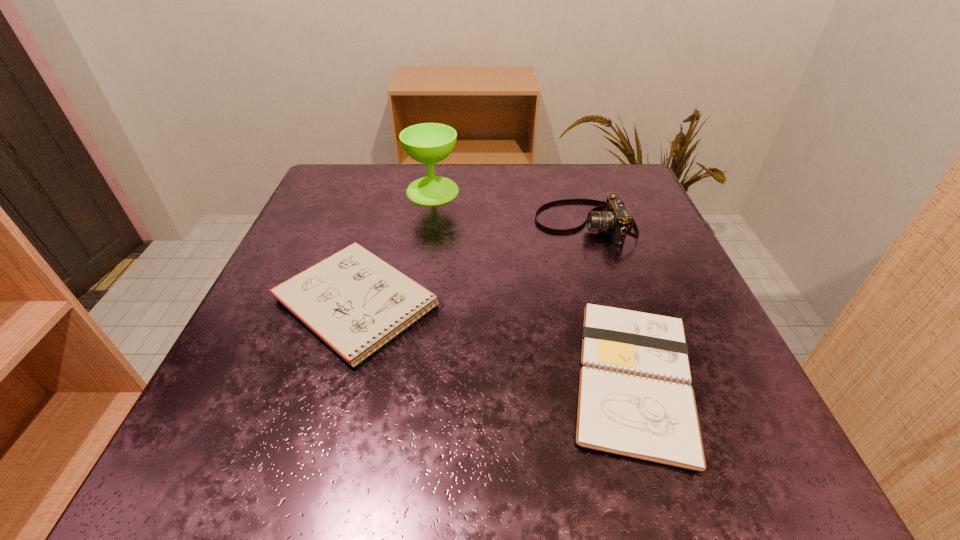
Locate an element on the screen. The width and height of the screenshot is (960, 540). vacant region located 0.120m on the right of the left notepad is located at coordinates (516, 303).

This screenshot has width=960, height=540. In order to click on vacant space situated 0.230m on the back of the shorter notepad in this screenshot , I will do `click(588, 228)`.

Image resolution: width=960 pixels, height=540 pixels. In order to click on wineglass situated at the far edge in this screenshot , I will do click(428, 143).

Find the location of `camera that is at the far edge`. camera that is at the far edge is located at coordinates (615, 218).

The image size is (960, 540). What are the coordinates of `object located in the near edge section of the desktop` in the screenshot? It's located at (635, 399).

The width and height of the screenshot is (960, 540). I want to click on object present at the left edge, so click(x=353, y=300).

Where is `camera positioned at the right edge`? camera positioned at the right edge is located at coordinates (615, 218).

Image resolution: width=960 pixels, height=540 pixels. Find the location of `notepad positioned at the right edge`. notepad positioned at the right edge is located at coordinates (635, 399).

The image size is (960, 540). Identify the location of object that is at the far right corner. (615, 218).

Where is `object located at the near right corner`? This screenshot has height=540, width=960. object located at the near right corner is located at coordinates (635, 399).